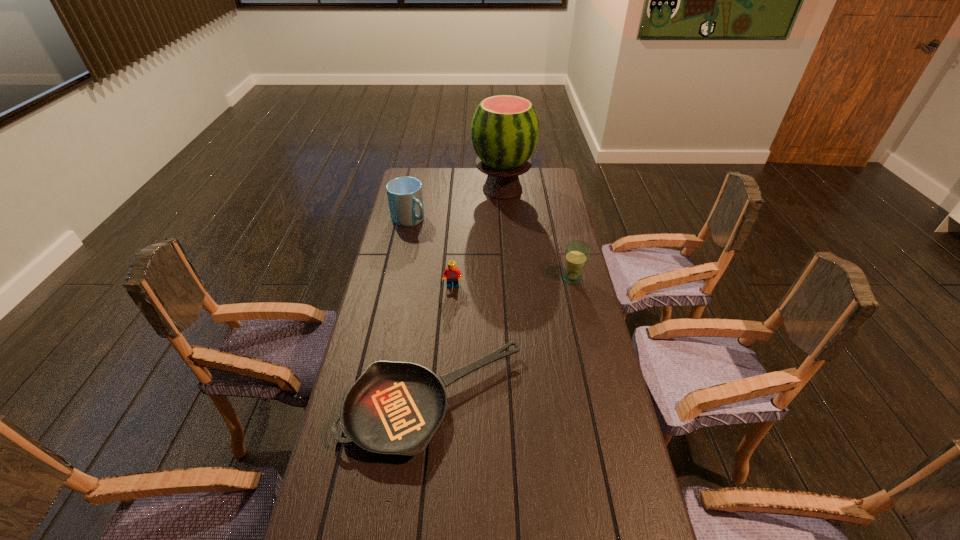
What are the coordinates of `the farthest object` in the screenshot? It's located at (505, 129).

Find the location of a particular element. Image resolution: width=960 pixels, height=540 pixels. watermelon is located at coordinates (505, 129).

You are a GUI agent. You are given a task and a screenshot of the screen. Output one action in this format:
    pyautogui.click(x=<x>, y=<y>)
    Task: Click on the fourth nearest object
    This screenshot has height=540, width=960.
    Given the screenshot: What is the action you would take?
    pyautogui.click(x=405, y=197)

Image resolution: width=960 pixels, height=540 pixels. I want to click on glass, so [577, 252].

This screenshot has height=540, width=960. I want to click on the fourth tallest object, so click(x=452, y=274).

I want to click on frying pan, so click(394, 408).

In order to click on the nearest object in this screenshot , I will do `click(394, 408)`.

Where is `vacant position located on the front of the watermelon`? vacant position located on the front of the watermelon is located at coordinates (506, 231).

Where is `free space located on the back of the fourth nearest object`? This screenshot has height=540, width=960. free space located on the back of the fourth nearest object is located at coordinates (415, 195).

The width and height of the screenshot is (960, 540). Identify the location of free spot located 0.340m on the front of the rightmost object. (591, 362).